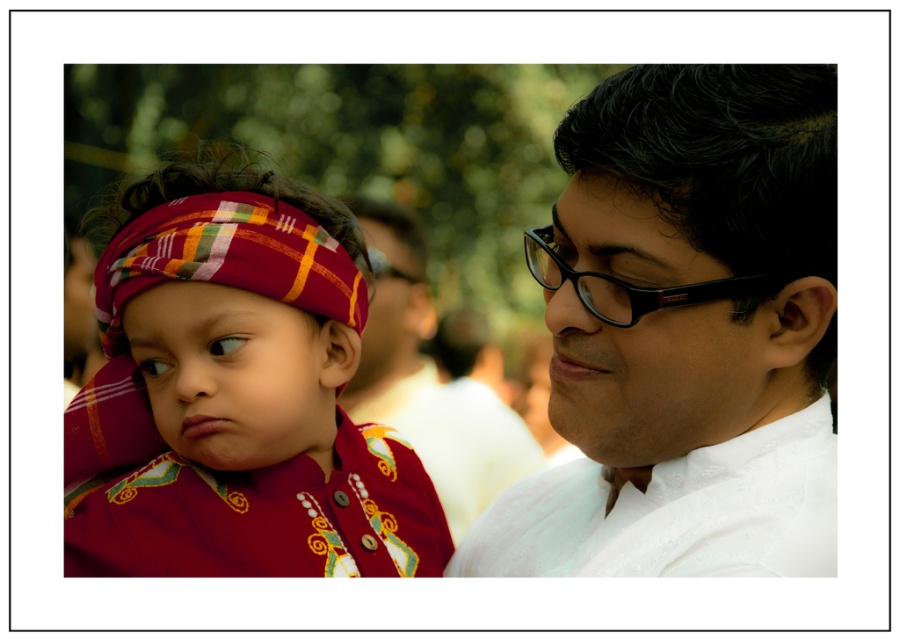
You are a photographer trying to capture a close up shot of the black plastic glasses at right. You need to focus on the glasses, but the white textured shirt at right is in the way. Can you move the glasses closer to the camera so they are not blocked by the shirt?

The white textured shirt at right is bigger than black plastic glasses at right, so moving the glasses closer to the camera might help them appear larger and less blocked by the shirt.

You are taking a photo of two people in the scene. You want to focus on the person closer to the camera. Which point should you focus on, point (x=594, y=150) or point (x=612, y=300)?

Point (x=594, y=150) is closer to the camera than point (x=612, y=300), so you should focus on point (x=594, y=150).